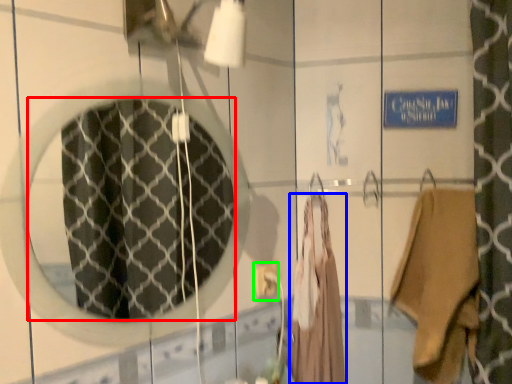
Question: Considering the real-world distances, which object is farthest from mirror (highlighted by a red box)? clothing (highlighted by a blue box) or electric outlet (highlighted by a green box)?

Choices:
 (A) clothing
 (B) electric outlet

Answer: (B)